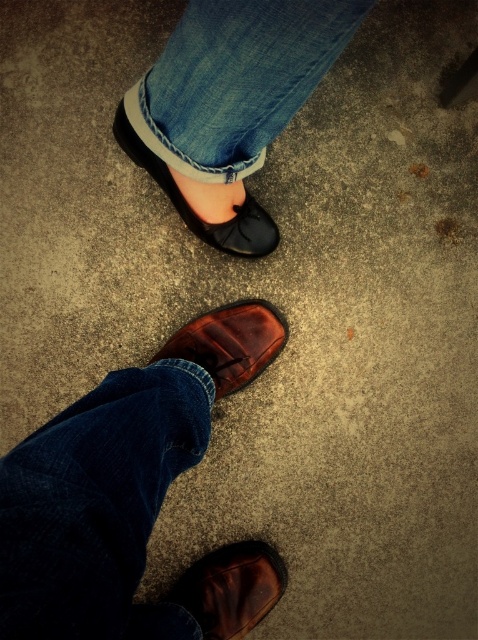
You are standing in a room and see two shoes on the floor. You need to place a small object exactly at point (x=231, y=588). Which shoe should you place it on?

The point (x=231, y=588) corresponds to the brown leather shoe at lower center, so you should place the object there.

You are trying to decide which footwear to wear for a casual event. Based on the image, which item is more suitable for a casual look between the dark blue denim jeans at lower left and the matte black shoe at center?

The matte black shoe at center is more suitable for a casual look because the dark blue denim jeans at lower left are larger in size compared to the matte black shoe at center, indicating they might not be the intended pair for casual wear.